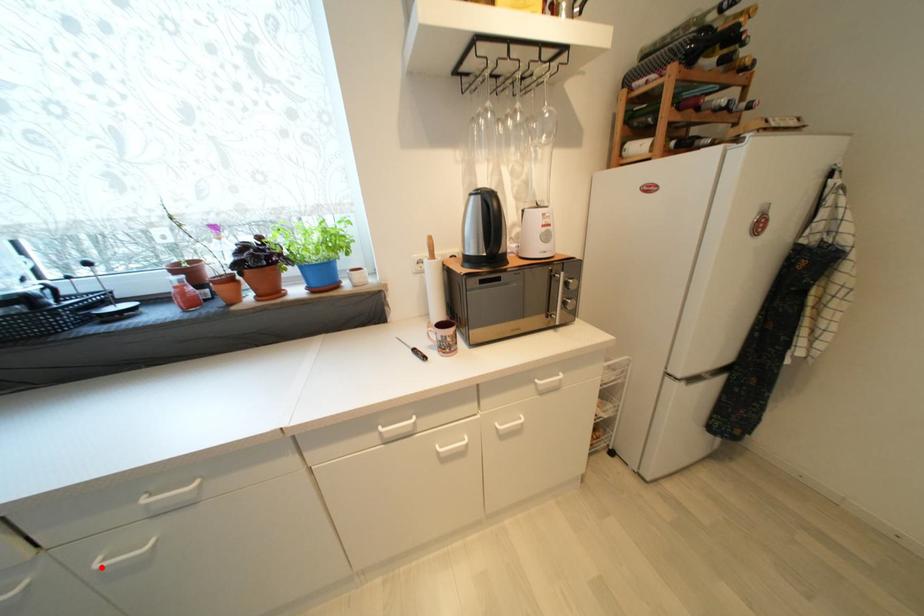
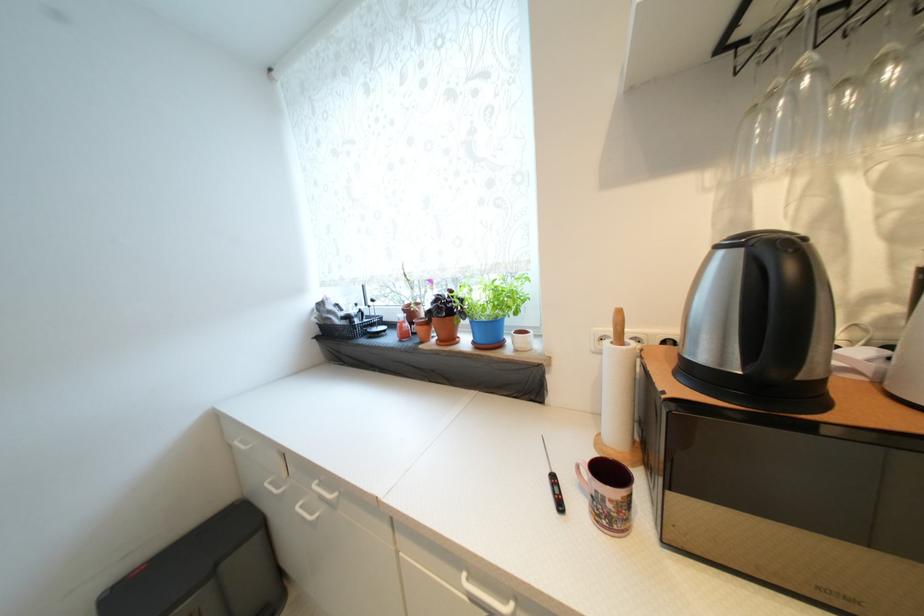
In the second image, find the point that corresponds to the highlighted location in the first image.

(302, 509)